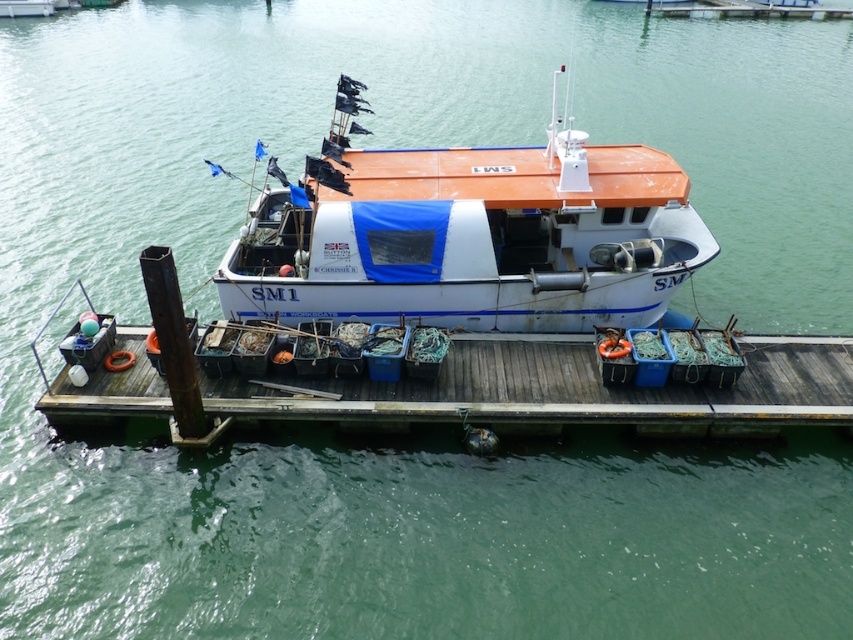
Where is `white matte boat at center`? The width and height of the screenshot is (853, 640). white matte boat at center is located at coordinates (468, 234).

Where is `white matte boat at center`? Image resolution: width=853 pixels, height=640 pixels. white matte boat at center is located at coordinates (468, 234).